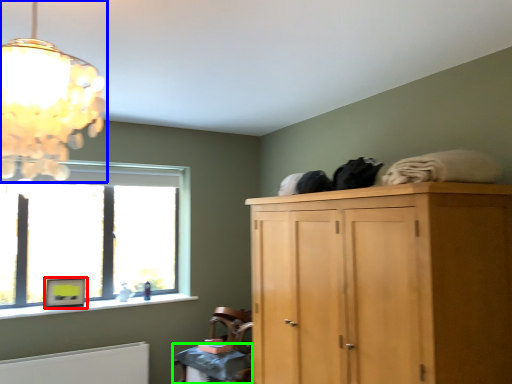
Question: Considering the real-world distances, which object is closest to picture frame (highlighted by a red box)? lamp (highlighted by a blue box) or table (highlighted by a green box).

Choices:
 (A) lamp
 (B) table

Answer: (B)